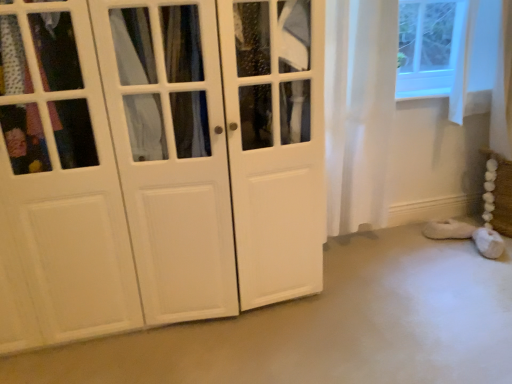
In order to click on free spot in front of white fluffy slipper at lower right in this screenshot , I will do `click(452, 255)`.